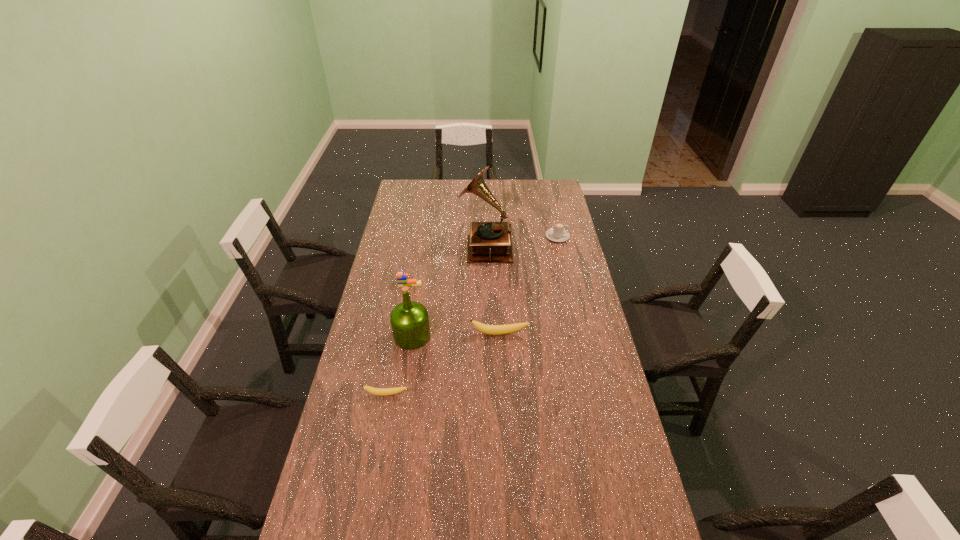
Locate an element on the screen. This screenshot has width=960, height=540. vacant space at the left edge of the desktop is located at coordinates (391, 303).

This screenshot has width=960, height=540. I want to click on vacant space at the right edge of the desktop, so click(x=588, y=422).

Where is `free region at the far left corner of the desktop`? free region at the far left corner of the desktop is located at coordinates (397, 198).

The image size is (960, 540). Find the location of `free space at the far right corner of the desktop`. free space at the far right corner of the desktop is located at coordinates (536, 192).

Locate an element on the screen. Image resolution: width=960 pixels, height=540 pixels. vacant point located between the shortest object and the tallest object is located at coordinates (436, 320).

Find the location of `vacant area between the tallest object and the cappuccino`. vacant area between the tallest object and the cappuccino is located at coordinates (521, 241).

Locate an element on the screen. This screenshot has width=960, height=540. empty space that is in between the tallest object and the second tallest object is located at coordinates (448, 291).

The image size is (960, 540). I want to click on empty space that is in between the olive oil and the rightmost object, so click(x=485, y=286).

Image resolution: width=960 pixels, height=540 pixels. I want to click on unoccupied area between the olive oil and the nearer banana, so click(x=399, y=366).

Identify the location of free space between the tallest object and the fifth shortest object. (448, 291).